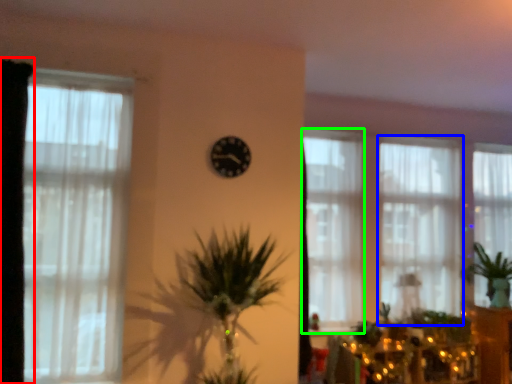
Question: Which object is the farthest from curtain (highlighted by a red box)? Choose among these: window (highlighted by a blue box) or window (highlighted by a green box).

Choices:
 (A) window
 (B) window

Answer: (A)